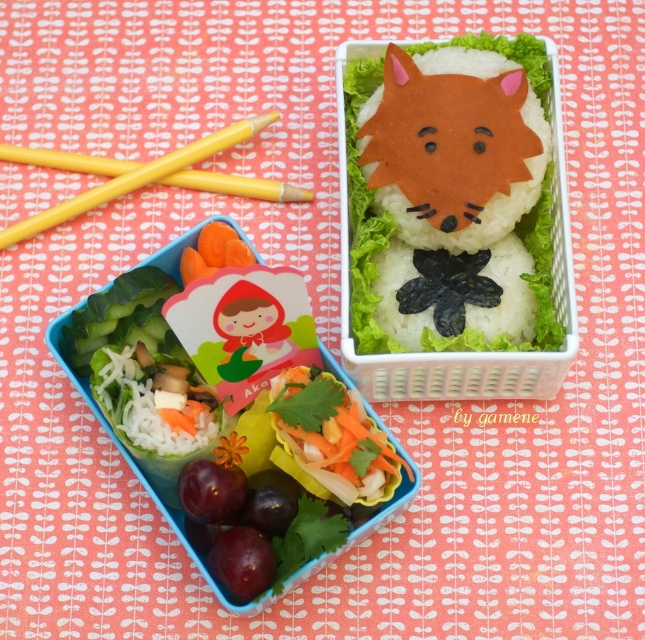
Question: Which object is the farthest from the white rice with seaweed at upper center?

Choices:
 (A) yellow wood chopsticks at upper left
 (B) fresh green salad at lower left
 (C) yellow plastic chopsticks at upper left
 (D) orange matte rice fox at upper center

Answer: (A)

Question: In this image, where is yellow plastic chopsticks at upper left located relative to yellow wood chopsticks at upper left?

Choices:
 (A) right
 (B) left

Answer: (B)

Question: Is yellow plastic chopsticks at upper left below fresh green salad at lower left?

Choices:
 (A) no
 (B) yes

Answer: (A)

Question: Based on their relative distances, which object is farther from the yellow wood chopsticks at upper left?

Choices:
 (A) orange matte rice fox at upper center
 (B) white rice with seaweed at upper center

Answer: (B)

Question: Which point is farther to the camera?

Choices:
 (A) (470, 394)
 (B) (264, 262)
 (C) (430, 136)

Answer: (B)

Question: Is yellow plastic chopsticks at upper left below fresh green salad at lower left?

Choices:
 (A) no
 (B) yes

Answer: (A)